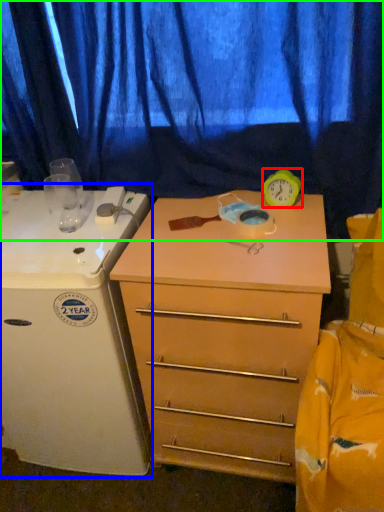
Question: Based on their relative distances, which object is nearer to clock (highlighted by a red box)? Choose from appliance (highlighted by a blue box) and curtain (highlighted by a green box).

Choices:
 (A) appliance
 (B) curtain

Answer: (B)